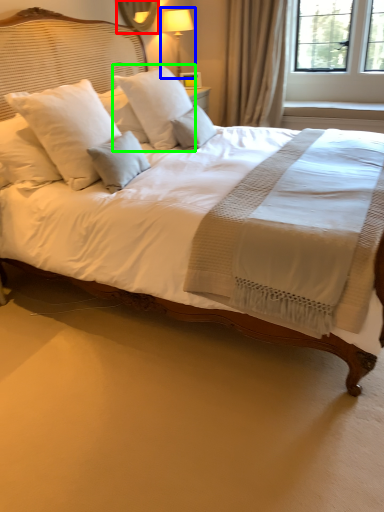
Question: Which object is the farthest from mirror (highlighted by a red box)? Choose among these: bedside lamp (highlighted by a blue box) or pillow (highlighted by a green box).

Choices:
 (A) bedside lamp
 (B) pillow

Answer: (B)